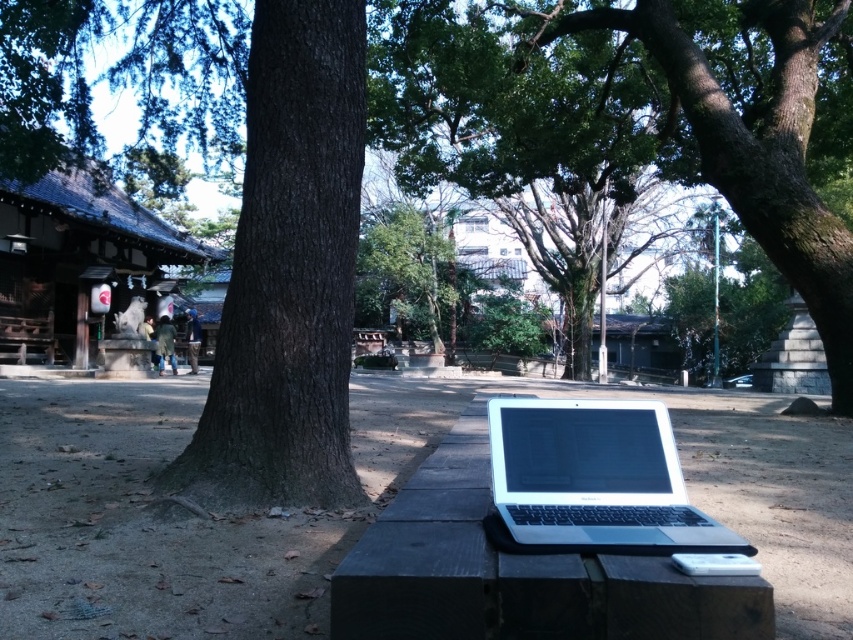
You are standing in a park and want to take a photo of the wooden shrine at left. To avoid including the dark brown textured tree trunk at center in your photo, which direction should you move relative to the shrine?

Move to the left side of the wooden shrine at left to avoid the dark brown textured tree trunk at center appearing in the photo since the tree trunk is positioned to the right of the shrine.

You are standing in the park and want to find the dark brown textured tree trunk at center. According to the coordinates provided, where should you look relative to the bench?

The dark brown textured tree trunk at center is located at point coordinates, so you should look towards the center area of the scene where the coordinates indicate its position relative to the bench.